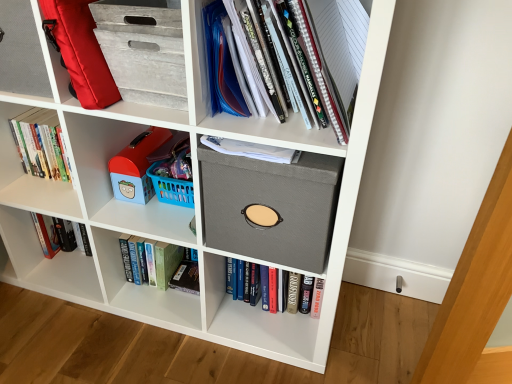
Where is `free location to the right of hardcover book at center, which is the 3th book from top to bottom`? The width and height of the screenshot is (512, 384). free location to the right of hardcover book at center, which is the 3th book from top to bottom is located at coordinates (351, 330).